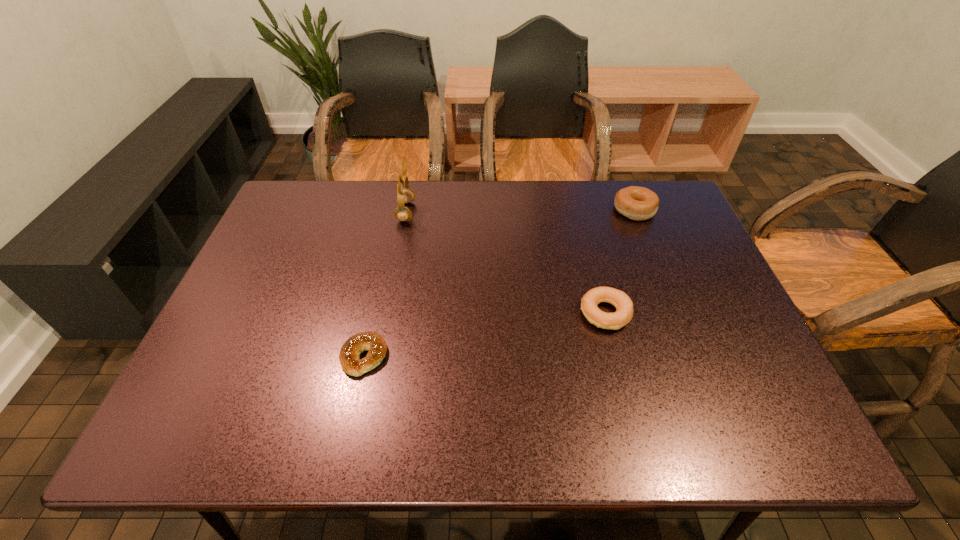
This screenshot has height=540, width=960. Identify the location of vacant space situated 0.150m on the right of the shortest bagel. (454, 356).

Locate an element on the screen. The width and height of the screenshot is (960, 540). earphone that is at the far edge is located at coordinates (404, 195).

Locate an element on the screen. This screenshot has height=540, width=960. bagel that is at the far edge is located at coordinates (637, 203).

This screenshot has width=960, height=540. I want to click on object located in the right edge section of the desktop, so click(x=637, y=203).

Where is `object that is positioned at the far right corner`? object that is positioned at the far right corner is located at coordinates (637, 203).

Locate an element on the screen. This screenshot has height=540, width=960. vacant space at the far edge is located at coordinates (396, 188).

Find the location of `vacant space at the near edge of the desktop`. vacant space at the near edge of the desktop is located at coordinates (562, 413).

Locate an element on the screen. Image resolution: width=960 pixels, height=540 pixels. vacant area at the left edge is located at coordinates (290, 247).

Where is `vacant space at the right edge of the desktop`? vacant space at the right edge of the desktop is located at coordinates pos(748,349).

This screenshot has height=540, width=960. Identify the location of free location at the far left corner. (300, 210).